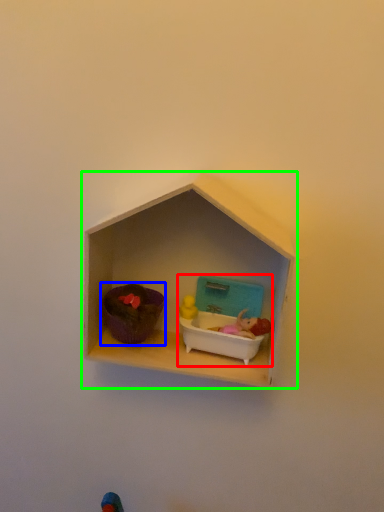
Question: Based on their relative distances, which object is farther from toy (highlighted by a red box)? Choose from toy (highlighted by a blue box) and shelf (highlighted by a green box).

Choices:
 (A) toy
 (B) shelf

Answer: (A)